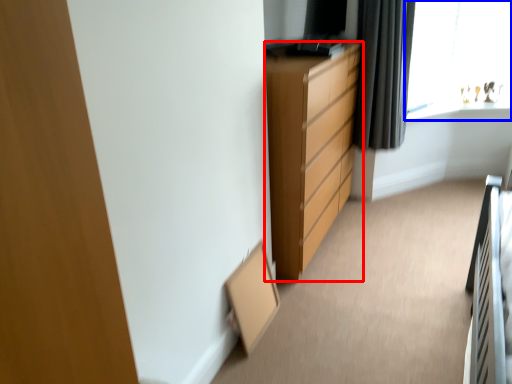
Question: Which point is further to the camera, chest of drawers (highlighted by a red box) or window (highlighted by a blue box)?

Choices:
 (A) chest of drawers
 (B) window

Answer: (B)